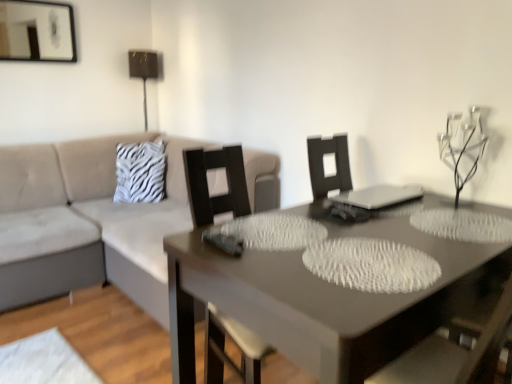
Question: Does beige fabric couch at left have a larger size compared to smooth gray table at center?

Choices:
 (A) no
 (B) yes

Answer: (B)

Question: From a real-world perspective, is beige fabric couch at left positioned under smooth gray table at center based on gravity?

Choices:
 (A) no
 (B) yes

Answer: (A)

Question: Is beige fabric couch at left surrounding smooth gray table at center?

Choices:
 (A) no
 (B) yes

Answer: (A)

Question: From the image's perspective, is beige fabric couch at left on top of smooth gray table at center?

Choices:
 (A) yes
 (B) no

Answer: (A)

Question: Is beige fabric couch at left to the right of smooth gray table at center from the viewer's perspective?

Choices:
 (A) yes
 (B) no

Answer: (B)

Question: From the image's perspective, is smooth gray table at center above or below beige fabric couch at left?

Choices:
 (A) above
 (B) below

Answer: (B)

Question: From a real-world perspective, is smooth gray table at center physically located above or below beige fabric couch at left?

Choices:
 (A) above
 (B) below

Answer: (B)

Question: Is point (361, 309) closer or farther from the camera than point (151, 251)?

Choices:
 (A) farther
 (B) closer

Answer: (B)

Question: Considering the positions of smooth gray table at center and beige fabric couch at left in the image, is smooth gray table at center wider or thinner than beige fabric couch at left?

Choices:
 (A) thin
 (B) wide

Answer: (A)

Question: Considering their positions, is white zebra print pillow at upper left located in front of or behind metallic gold table lamp at upper center?

Choices:
 (A) behind
 (B) front

Answer: (B)

Question: Is white zebra print pillow at upper left bigger or smaller than metallic gold table lamp at upper center?

Choices:
 (A) big
 (B) small

Answer: (B)

Question: Would you say white zebra print pillow at upper left is to the left or to the right of metallic gold table lamp at upper center in the picture?

Choices:
 (A) left
 (B) right

Answer: (B)

Question: From the image's perspective, is white zebra print pillow at upper left located above or below metallic gold table lamp at upper center?

Choices:
 (A) above
 (B) below

Answer: (B)

Question: Do you think clear glass candle holder at upper right is within beige fabric couch at left, or outside of it?

Choices:
 (A) outside
 (B) inside

Answer: (A)

Question: Considering the relative positions of clear glass candle holder at upper right and beige fabric couch at left in the image provided, is clear glass candle holder at upper right to the left or to the right of beige fabric couch at left?

Choices:
 (A) right
 (B) left

Answer: (A)